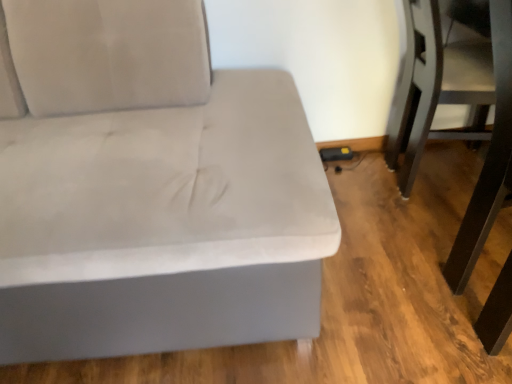
Question: Is dark brown wood swivel chair at lower right inside the boundaries of suede-like gray couch at left, or outside?

Choices:
 (A) inside
 (B) outside

Answer: (B)

Question: From the image's perspective, relative to suede-like gray couch at left, is dark brown wood swivel chair at lower right above or below?

Choices:
 (A) below
 (B) above

Answer: (B)

Question: Is dark brown wood swivel chair at lower right to the left or to the right of suede-like gray couch at left in the image?

Choices:
 (A) right
 (B) left

Answer: (A)

Question: In terms of height, does suede-like gray couch at left look taller or shorter compared to dark brown wood swivel chair at lower right?

Choices:
 (A) short
 (B) tall

Answer: (B)

Question: Based on their sizes in the image, would you say suede-like gray couch at left is bigger or smaller than dark brown wood swivel chair at lower right?

Choices:
 (A) small
 (B) big

Answer: (B)

Question: From the image's perspective, is suede-like gray couch at left located above or below dark brown wood swivel chair at lower right?

Choices:
 (A) above
 (B) below

Answer: (B)

Question: From a real-world perspective, relative to dark brown wood swivel chair at lower right, is suede-like gray couch at left vertically above or below?

Choices:
 (A) above
 (B) below

Answer: (A)